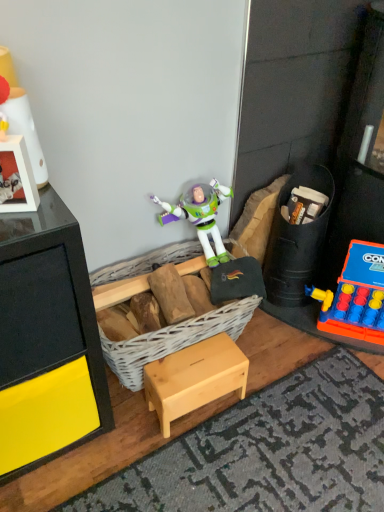
Image resolution: width=384 pixels, height=512 pixels. Find the location of `matte white lamp at upper left, which appears as the first toy when viewed from the front`. matte white lamp at upper left, which appears as the first toy when viewed from the front is located at coordinates (22, 118).

What do you see at coordinates (355, 296) in the screenshot? The image size is (384, 512). I see `rubberized plastic game at right, positioned as the first toy in right-to-left order` at bounding box center [355, 296].

What is the approximate width of rubberized plastic game at right, positioned as the first toy in right-to-left order?

rubberized plastic game at right, positioned as the first toy in right-to-left order, is 3.47 inches in width.

This screenshot has height=512, width=384. In order to click on white wicker basket at center in this screenshot , I will do `click(173, 339)`.

The width and height of the screenshot is (384, 512). What do you see at coordinates (173, 339) in the screenshot?
I see `white wicker basket at center` at bounding box center [173, 339].

What is the approximate width of rubberized plastic toy at right, arranged as the 1th toy when viewed from the back?

rubberized plastic toy at right, arranged as the 1th toy when viewed from the back, is 9.27 inches wide.

Find the location of a particular element. The height and width of the screenshot is (512, 384). matte white lamp at upper left, arranged as the third toy when viewed from the right is located at coordinates (22, 118).

From a real-world perspective, between white wicker basket at center and matte white lamp at upper left, which appears as the first toy when viewed from the front, who is vertically lower?

white wicker basket at center, from a real-world perspective.

Can you confirm if white wicker basket at center is smaller than matte white lamp at upper left, arranged as the third toy when viewed from the right?

No, white wicker basket at center is not smaller than matte white lamp at upper left, arranged as the third toy when viewed from the right.

From the image's perspective, which object appears higher, white wicker basket at center or matte white lamp at upper left, arranged as the third toy when viewed from the right?

matte white lamp at upper left, arranged as the third toy when viewed from the right, from the image's perspective.

In the scene shown: Is white wicker basket at center not inside rubberized plastic game at right, arranged as the second toy when viewed from the front?

Absolutely, white wicker basket at center is external to rubberized plastic game at right, arranged as the second toy when viewed from the front.

From the image's perspective, is white wicker basket at center positioned above or below rubberized plastic game at right, the third toy from the left?

Based on their image positions, white wicker basket at center is located beneath rubberized plastic game at right, the third toy from the left.

Considering the relative positions of white wicker basket at center and rubberized plastic game at right, arranged as the second toy when viewed from the front, in the image provided, is white wicker basket at center behind rubberized plastic game at right, arranged as the second toy when viewed from the front,?

No, white wicker basket at center is closer to the viewer.

In terms of height, does white wicker basket at center look taller or shorter compared to rubberized plastic game at right, the third toy from the left?

In the image, white wicker basket at center appears to be shorter than rubberized plastic game at right, the third toy from the left.

Is matte white lamp at upper left, which ranks as the third toy in back-to-front order, directly adjacent to rubberized plastic toy at right, the second toy positioned from the right?

matte white lamp at upper left, which ranks as the third toy in back-to-front order, and rubberized plastic toy at right, the second toy positioned from the right, are not in contact.

Does matte white lamp at upper left, which ranks as the third toy in back-to-front order, have a lesser height compared to rubberized plastic toy at right, the 3th toy viewed from the front?

Indeed, matte white lamp at upper left, which ranks as the third toy in back-to-front order, has a lesser height compared to rubberized plastic toy at right, the 3th toy viewed from the front.

Image resolution: width=384 pixels, height=512 pixels. I want to click on toy above the rubberized plastic toy at right, the 3th toy viewed from the front (from a real-world perspective), so click(x=22, y=118).

Does matte white lamp at upper left, arranged as the third toy when viewed from the right, have a smaller size compared to rubberized plastic toy at right, the 3th toy viewed from the front?

Yes, matte white lamp at upper left, arranged as the third toy when viewed from the right, is smaller than rubberized plastic toy at right, the 3th toy viewed from the front.

Where is `toy that is the 2nd one when counting upward from the rubberized plastic game at right, which appears as the 2th toy when viewed from the back (from the image's perspective)`? toy that is the 2nd one when counting upward from the rubberized plastic game at right, which appears as the 2th toy when viewed from the back (from the image's perspective) is located at coordinates (22, 118).

Based on the photo, which is nearer, (x=354, y=333) or (x=11, y=88)?

Point (x=354, y=333).

Considering the sizes of objects rubberized plastic game at right, arranged as the second toy when viewed from the front, and matte white lamp at upper left, arranged as the third toy when viewed from the right, in the image provided, who is bigger, rubberized plastic game at right, arranged as the second toy when viewed from the front, or matte white lamp at upper left, arranged as the third toy when viewed from the right,?

Bigger between the two is rubberized plastic game at right, arranged as the second toy when viewed from the front.

Who is more distant, rubberized plastic game at right, the third toy from the left, or matte white lamp at upper left, which appears as the first toy when viewed from the front?

rubberized plastic game at right, the third toy from the left, is further away from the camera.

Is rubberized plastic toy at right, the second toy positioned from the right, directly adjacent to matte white lamp at upper left, arranged as the third toy when viewed from the right?

No, rubberized plastic toy at right, the second toy positioned from the right, is not with matte white lamp at upper left, arranged as the third toy when viewed from the right.

Which object is further away from the camera, rubberized plastic toy at right, the second toy positioned from the right, or matte white lamp at upper left, which appears as the first toy when viewed from the front?

rubberized plastic toy at right, the second toy positioned from the right, is more distant.

From a real-world perspective, between rubberized plastic toy at right, the second toy positioned from the right, and matte white lamp at upper left, which ranks as the third toy in back-to-front order, who is vertically higher?

matte white lamp at upper left, which ranks as the third toy in back-to-front order, is physically above.

Measure the distance between rubberized plastic toy at right, which is the second toy from left to right, and matte white lamp at upper left, arranged as the third toy when viewed from the right.

rubberized plastic toy at right, which is the second toy from left to right, is 93.50 centimeters from matte white lamp at upper left, arranged as the third toy when viewed from the right.

Can you confirm if matte white lamp at upper left, which appears as the first toy when viewed from the front, is taller than rubberized plastic game at right, arranged as the second toy when viewed from the front?

No, matte white lamp at upper left, which appears as the first toy when viewed from the front, is not taller than rubberized plastic game at right, arranged as the second toy when viewed from the front.

Which is correct: matte white lamp at upper left, acting as the first toy starting from the left, is inside rubberized plastic game at right, positioned as the first toy in right-to-left order, or outside of it?

matte white lamp at upper left, acting as the first toy starting from the left, is located beyond the bounds of rubberized plastic game at right, positioned as the first toy in right-to-left order.

What's the angular difference between matte white lamp at upper left, acting as the first toy starting from the left, and rubberized plastic game at right, positioned as the first toy in right-to-left order,'s facing directions?

Answer: The angular difference between matte white lamp at upper left, acting as the first toy starting from the left, and rubberized plastic game at right, positioned as the first toy in right-to-left order, is 50.8 degrees.

From a real-world perspective, is matte white lamp at upper left, acting as the first toy starting from the left, physically above white wicker basket at center?

Yes, from a real-world perspective, matte white lamp at upper left, acting as the first toy starting from the left, is over white wicker basket at center

From the image's perspective, which one is positioned higher, matte white lamp at upper left, acting as the first toy starting from the left, or white wicker basket at center?

From the image's view, matte white lamp at upper left, acting as the first toy starting from the left, is above.

Would you consider matte white lamp at upper left, arranged as the third toy when viewed from the right, to be distant from white wicker basket at center?

matte white lamp at upper left, arranged as the third toy when viewed from the right, is actually quite close to white wicker basket at center.

Considering the points (21, 123) and (147, 258), which point is behind, point (21, 123) or point (147, 258)?

The point (147, 258) is farther from the camera.

You are a GUI agent. You are given a task and a screenshot of the screen. Output one action in this format:
    pyautogui.click(x=<x>, y=<y>)
    Task: Click on the basket behind the matte white lamp at upper left, acting as the first toy starting from the left
    The width and height of the screenshot is (384, 512).
    Given the screenshot: What is the action you would take?
    pyautogui.click(x=173, y=339)

This screenshot has height=512, width=384. Identify the location of the 2nd toy to the right of the white wicker basket at center, counting from the anchor's position. (355, 296).

Considering their positions, is natural wood stool at center positioned further to rubberized plastic game at right, which appears as the 2th toy when viewed from the back, than matte white lamp at upper left, acting as the first toy starting from the left?

matte white lamp at upper left, acting as the first toy starting from the left.

In the scene shown: Estimate the real-world distances between objects in this image. Which object is further from white wicker basket at center, matte white lamp at upper left, which appears as the first toy when viewed from the front, or rubberized plastic toy at right, which is the second toy from left to right?

matte white lamp at upper left, which appears as the first toy when viewed from the front, is further to white wicker basket at center.

When comparing their distances from matte white lamp at upper left, which appears as the first toy when viewed from the front, does white wicker basket at center or rubberized plastic game at right, which appears as the 2th toy when viewed from the back, seem closer?

white wicker basket at center is closer to matte white lamp at upper left, which appears as the first toy when viewed from the front.

Based on their spatial positions, is rubberized plastic game at right, positioned as the first toy in right-to-left order, or matte white lamp at upper left, which ranks as the third toy in back-to-front order, closer to natural wood stool at center?

The object closer to natural wood stool at center is rubberized plastic game at right, positioned as the first toy in right-to-left order.

Looking at the image, which one is located further to white wicker basket at center, matte white lamp at upper left, acting as the first toy starting from the left, or natural wood stool at center?

matte white lamp at upper left, acting as the first toy starting from the left, lies further to white wicker basket at center than the other object.

From the image, which object appears to be nearer to white wicker basket at center, natural wood stool at center or matte white lamp at upper left, which ranks as the third toy in back-to-front order?

The object closer to white wicker basket at center is natural wood stool at center.

From the image, which object appears to be nearer to rubberized plastic toy at right, which is the second toy from left to right, white wicker basket at center or natural wood stool at center?

The object closer to rubberized plastic toy at right, which is the second toy from left to right, is white wicker basket at center.

When comparing their distances from natural wood stool at center, does white wicker basket at center or rubberized plastic toy at right, arranged as the 1th toy when viewed from the back, seem closer?

white wicker basket at center is closer to natural wood stool at center.

Identify the location of toy situated between matte white lamp at upper left, arranged as the third toy when viewed from the right, and rubberized plastic game at right, positioned as the first toy in right-to-left order, from left to right. (296, 241).

The width and height of the screenshot is (384, 512). What are the coordinates of `furniture between white wicker basket at center and rubberized plastic toy at right, the second toy positioned from the right, from left to right` in the screenshot? It's located at (194, 378).

Locate an element on the screen. toy between natural wood stool at center and rubberized plastic game at right, positioned as the first toy in right-to-left order, in the horizontal direction is located at coordinates (296, 241).

You are a GUI agent. You are given a task and a screenshot of the screen. Output one action in this format:
    pyautogui.click(x=<x>, y=<y>)
    Task: Click on the furniture between white wicker basket at center and rubberized plastic game at right, arranged as the second toy when viewed from the front, in the horizontal direction
    
    Given the screenshot: What is the action you would take?
    pyautogui.click(x=194, y=378)